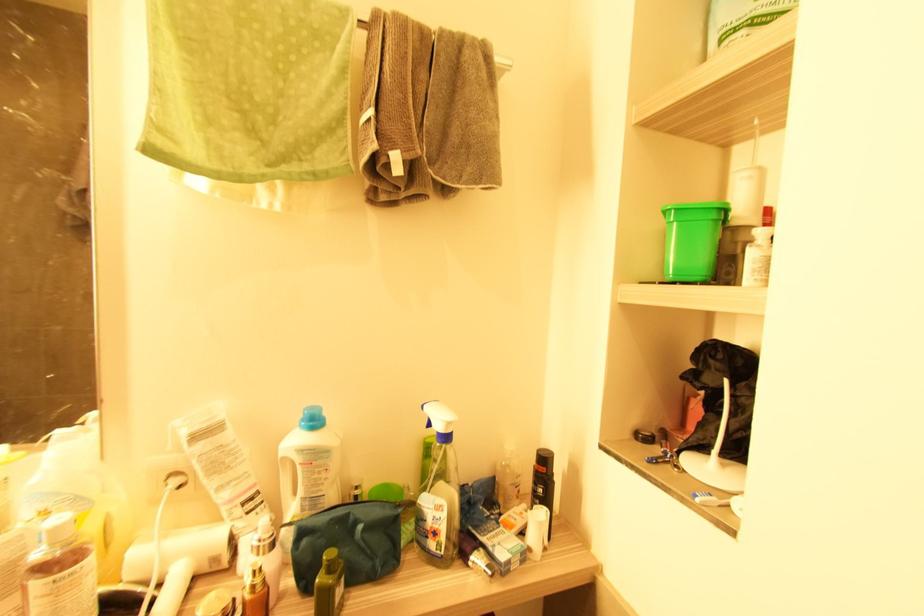
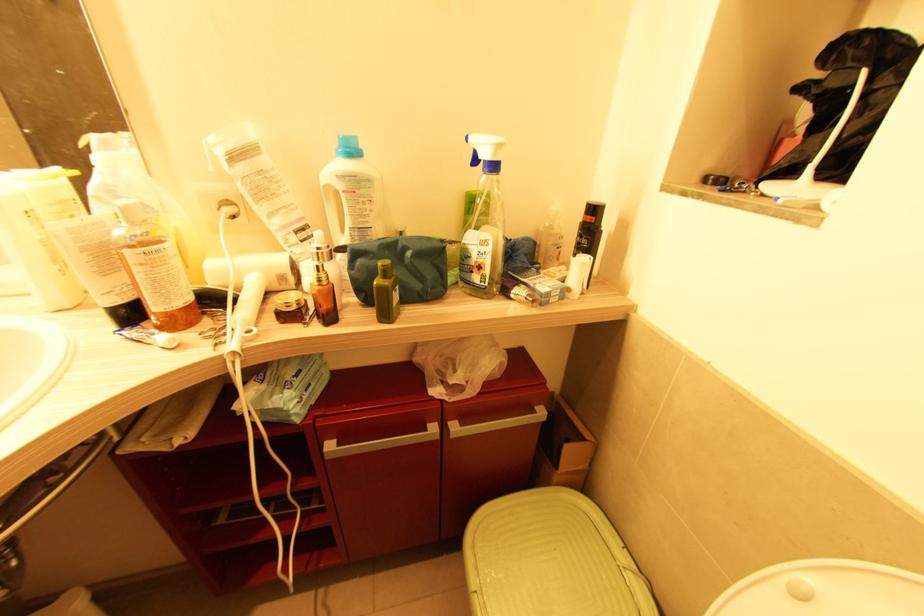
Locate, in the second image, the point that corresponds to point 361,529 in the first image.

(409, 254)